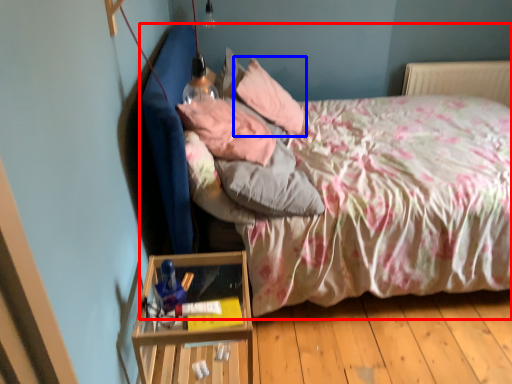
Question: Which of the following is the closest to the observer, bed (highlighted by a red box) or pillow (highlighted by a blue box)?

Choices:
 (A) bed
 (B) pillow

Answer: (A)